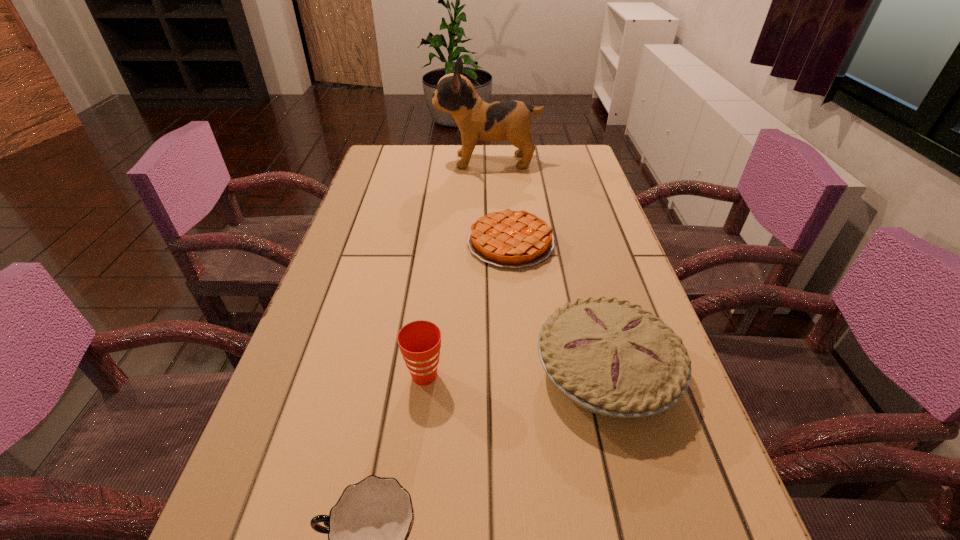
Where is `free spot between the farther cup and the second farthest object`? The image size is (960, 540). free spot between the farther cup and the second farthest object is located at coordinates (468, 309).

Identify the location of empty space that is in between the farther cup and the shortest object. This screenshot has height=540, width=960. (468, 309).

I want to click on empty space that is in between the farthest object and the nearer pie, so click(x=547, y=266).

At what (x,y) coordinates should I click in order to perform the action: click on vacant area that lies between the puppy and the shortest object. Please return your answer as a coordinate pair (x, y). This screenshot has width=960, height=540. Looking at the image, I should click on (499, 202).

This screenshot has width=960, height=540. Find the location of `free spot between the taller pie and the tallest object`. free spot between the taller pie and the tallest object is located at coordinates (547, 266).

Locate an element on the screen. This screenshot has width=960, height=540. empty space that is in between the tallest object and the farther cup is located at coordinates (456, 268).

I want to click on the closest object to the nearer cup, so click(x=419, y=341).

The image size is (960, 540). I want to click on object that is the third closest to the shortest object, so click(419, 341).

Image resolution: width=960 pixels, height=540 pixels. In order to click on vacant point that satisfies the following two spatial constraints: 1. at the face of the fourth nearest object; 2. on the left side of the puppy in this screenshot , I will do `click(491, 242)`.

Where is `free spot that satisfies the following two spatial constraints: 1. at the face of the farthest object; 2. on the right side of the taller pie`? The height and width of the screenshot is (540, 960). free spot that satisfies the following two spatial constraints: 1. at the face of the farthest object; 2. on the right side of the taller pie is located at coordinates (493, 370).